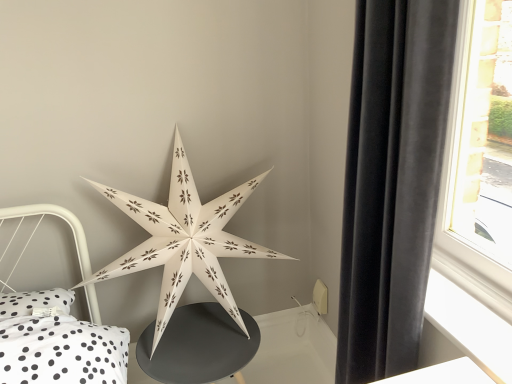
Question: Is matte black table at center further to camera compared to velvet black curtain at right?

Choices:
 (A) yes
 (B) no

Answer: (A)

Question: Is matte black table at center aimed at velvet black curtain at right?

Choices:
 (A) yes
 (B) no

Answer: (B)

Question: Is matte black table at center outside velvet black curtain at right?

Choices:
 (A) no
 (B) yes

Answer: (B)

Question: From the image's perspective, does matte black table at center appear lower than velvet black curtain at right?

Choices:
 (A) yes
 (B) no

Answer: (A)

Question: Would you say velvet black curtain at right is part of matte black table at center's contents?

Choices:
 (A) no
 (B) yes

Answer: (A)

Question: Considering the relative sizes of matte black table at center and velvet black curtain at right in the image provided, is matte black table at center bigger than velvet black curtain at right?

Choices:
 (A) no
 (B) yes

Answer: (A)

Question: Is white paper star at center shorter than matte black table at center?

Choices:
 (A) no
 (B) yes

Answer: (A)

Question: From the image's perspective, would you say white paper star at center is shown under matte black table at center?

Choices:
 (A) yes
 (B) no

Answer: (B)

Question: Considering the relative sizes of white paper star at center and matte black table at center in the image provided, is white paper star at center wider than matte black table at center?

Choices:
 (A) yes
 (B) no

Answer: (B)

Question: Is white paper star at center to the right of matte black table at center from the viewer's perspective?

Choices:
 (A) no
 (B) yes

Answer: (A)

Question: Is white paper star at center far from matte black table at center?

Choices:
 (A) yes
 (B) no

Answer: (B)

Question: Is white paper star at center aimed at matte black table at center?

Choices:
 (A) yes
 (B) no

Answer: (B)

Question: From a real-world perspective, is velvet black curtain at right located higher than white paper star at center?

Choices:
 (A) no
 (B) yes

Answer: (B)